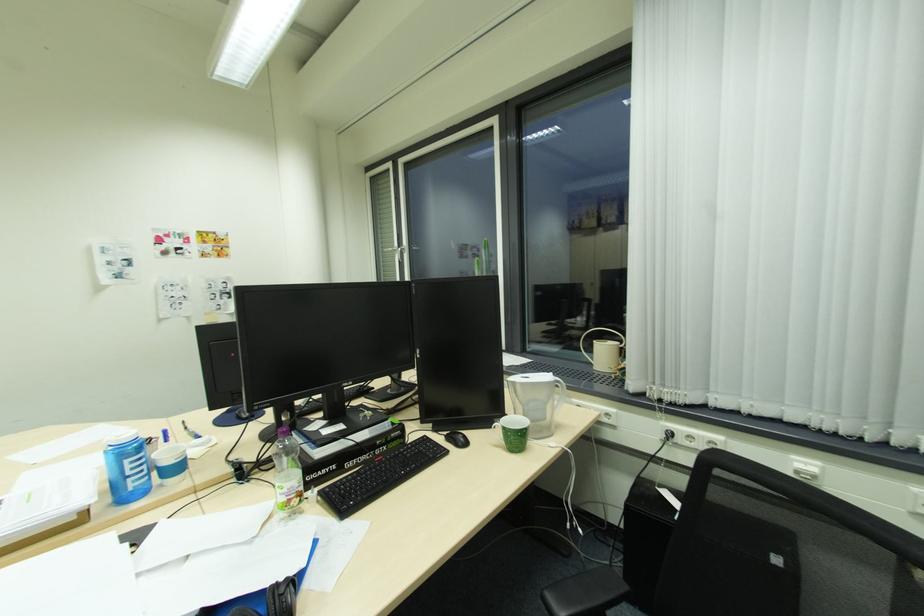
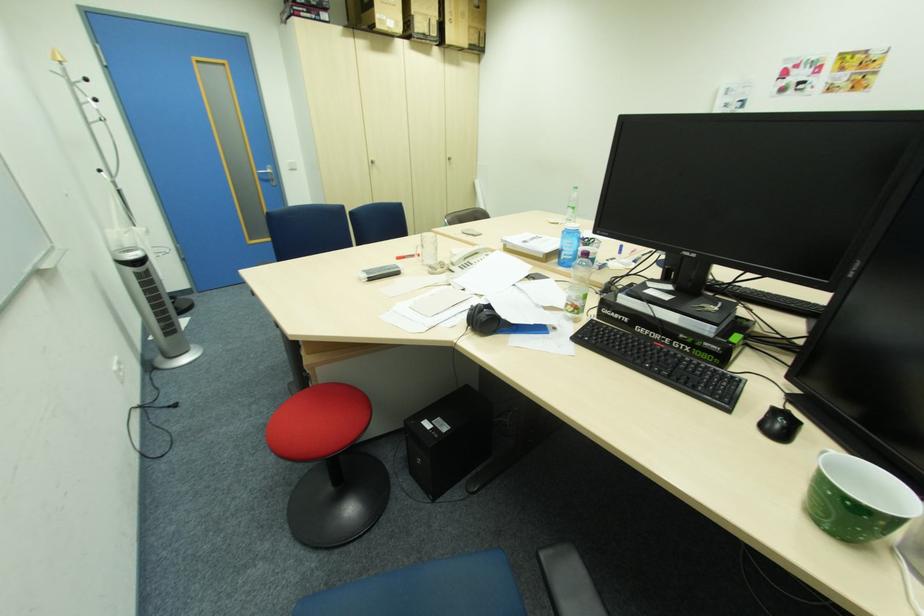
Where in the second image is the point corresponding to the point at 525,435 from the first image?

(833, 492)